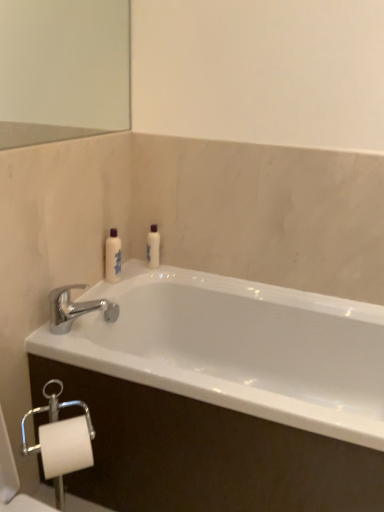
Question: From a real-world perspective, relative to chrome metallic faucet at upper left, is white glossy bottle at upper left, which ranks as the 1th toiletry in left-to-right order, vertically above or below?

Choices:
 (A) below
 (B) above

Answer: (B)

Question: Visually, is white glossy bottle at upper left, which ranks as the 1th toiletry in left-to-right order, positioned to the left or to the right of chrome metallic faucet at upper left?

Choices:
 (A) right
 (B) left

Answer: (A)

Question: Which object is positioned farthest from the chrome metallic faucet at upper left?

Choices:
 (A) white glossy bottle at upper left, placed as the 2th toiletry when sorted from right to left
 (B) white glossy lotion at center, positioned as the 2th toiletry in left-to-right order
 (C) white glossy bathtub at center

Answer: (C)

Question: Considering the real-world distances, which object is closest to the chrome metallic faucet at upper left?

Choices:
 (A) white glossy bathtub at center
 (B) white glossy lotion at center, the 1th toiletry viewed from the right
 (C) white glossy bottle at upper left, which ranks as the 1th toiletry in left-to-right order

Answer: (C)